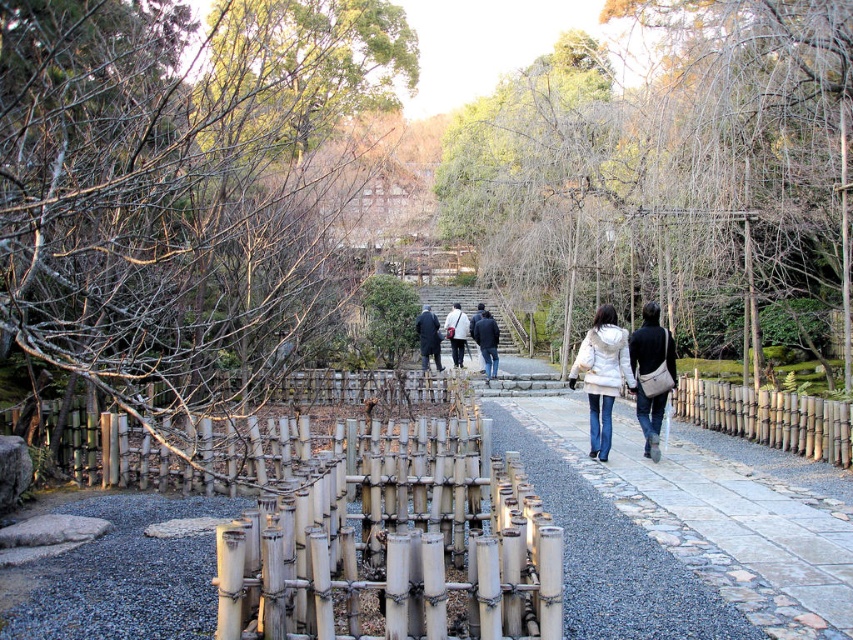
Can you confirm if bare branches at left is bigger than bamboo fence at right?

Yes, bare branches at left is bigger than bamboo fence at right.

Does bare branches at left have a lesser width compared to bamboo fence at right?

Incorrect, bare branches at left's width is not less than bamboo fence at right's.

Between point (120, 310) and point (849, 461), which one is positioned in front?

Positioned in front is point (120, 310).

Identify the location of bare branches at left. This screenshot has height=640, width=853. (180, 186).

Can you confirm if bamboo fence at right is positioned to the left of dark blue jeans at center?

Incorrect, bamboo fence at right is not on the left side of dark blue jeans at center.

Does bamboo fence at right have a smaller size compared to dark blue jeans at center?

Indeed, bamboo fence at right has a smaller size compared to dark blue jeans at center.

Identify the location of bamboo fence at right. (770, 417).

Is bare branches at center closer to the viewer compared to bamboo fence at right?

No.

Between bare branches at center and bamboo fence at right, which one is positioned lower?

bamboo fence at right is below.

Who is more distant from viewer, (561, 355) or (801, 454)?

The point (561, 355) is behind.

Where is `bare branches at center`? bare branches at center is located at coordinates point(672,172).